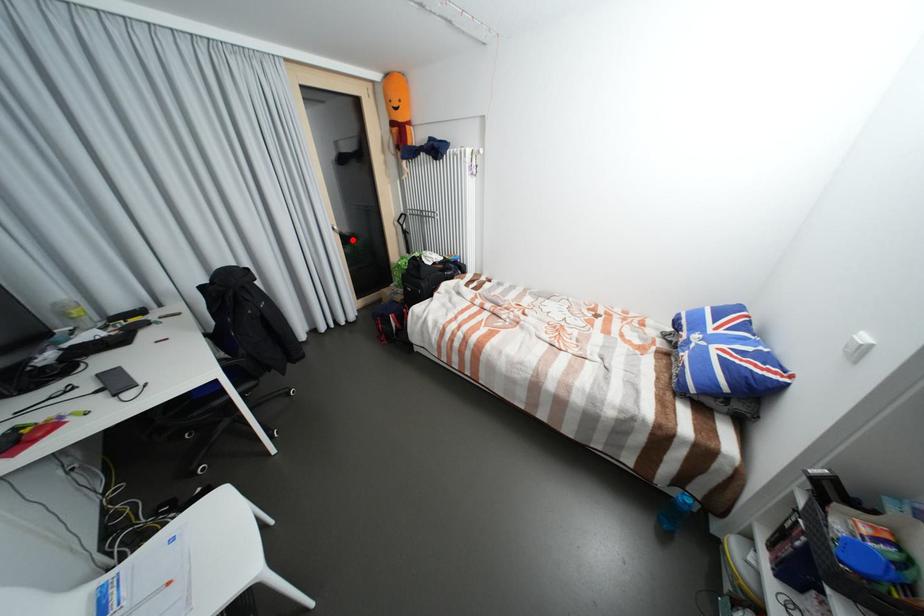
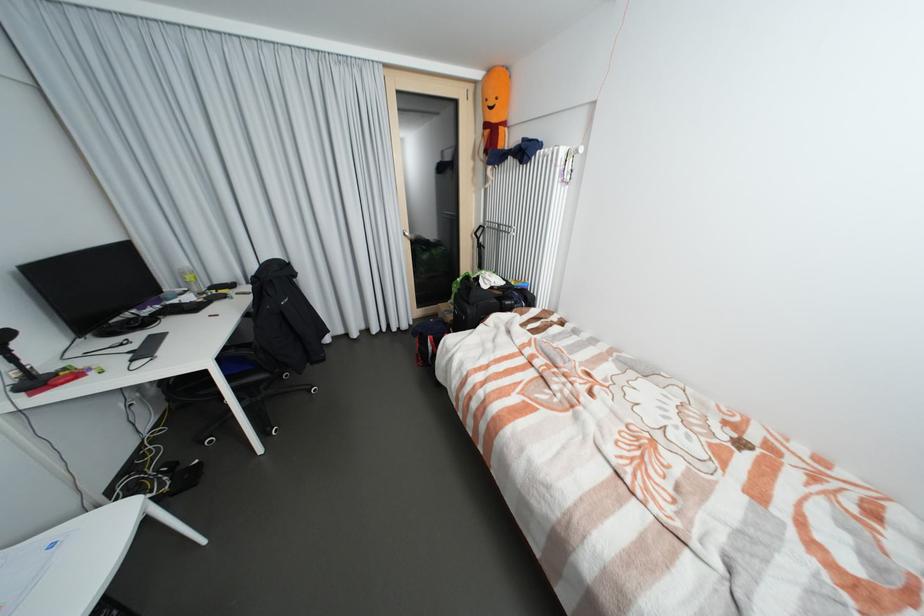
Question: I am providing you with two images of the same scene from different viewpoints. A red point is shown in image1. For the corresponding object point in image2, is it positioned nearer or farther from the camera?

Choices:
 (A) Nearer
 (B) Farther

Answer: (A)